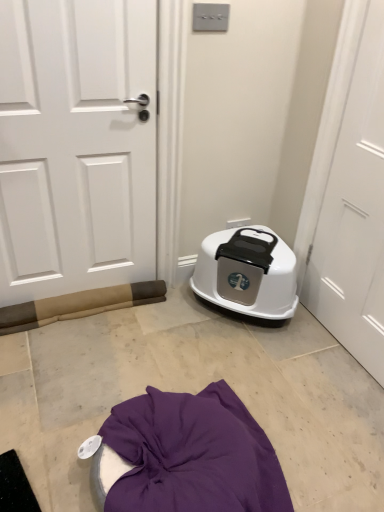
Find the location of `free space to the left of white matte door at right, arranged as the second door when viewed from the left`. free space to the left of white matte door at right, arranged as the second door when viewed from the left is located at coordinates (283, 350).